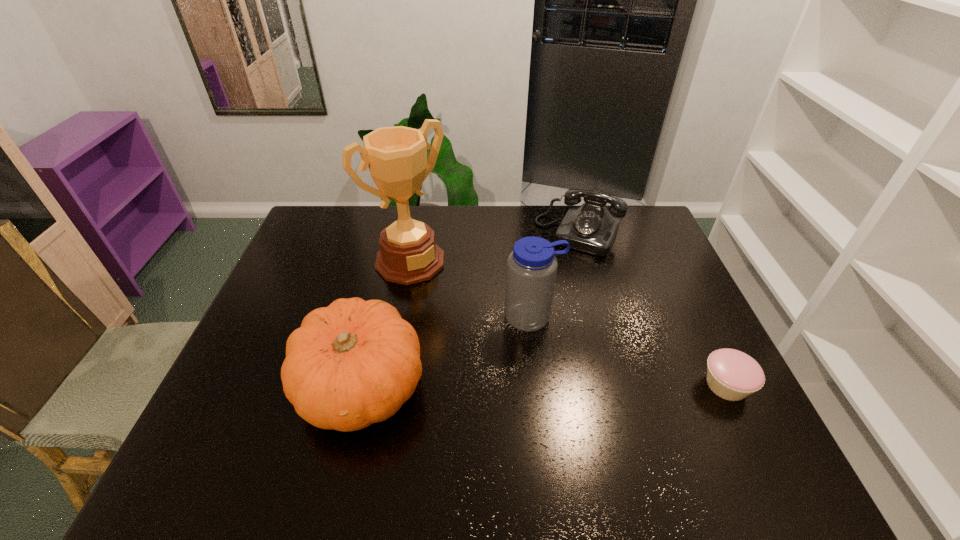
I want to click on free space at the near left corner of the desktop, so click(x=221, y=399).

At what (x,y) coordinates should I click in order to perform the action: click on free point at the far right corner. Please return your answer as a coordinate pair (x, y). The width and height of the screenshot is (960, 540). Looking at the image, I should click on (x=626, y=219).

I want to click on blank region between the third shortest object and the second shortest object, so click(470, 310).

Find the location of a particular element. blank region between the tallest object and the cupcake is located at coordinates point(568,323).

The image size is (960, 540). What are the coordinates of `free space between the tallest object and the second tallest object` in the screenshot? It's located at (471, 289).

Find the location of a particular element. This screenshot has height=540, width=960. vacant region between the rightmost object and the third nearest object is located at coordinates (629, 351).

You are a GUI agent. You are given a task and a screenshot of the screen. Output one action in this format:
    pyautogui.click(x=<x>, y=<y>)
    Task: Click on the empty location between the telephone and the tallest object
    The width and height of the screenshot is (960, 540).
    Given the screenshot: What is the action you would take?
    pyautogui.click(x=494, y=248)

The image size is (960, 540). In order to click on vacant point located between the cupcake and the award in this screenshot , I will do `click(568, 323)`.

Find the location of a particular element. This screenshot has height=540, width=960. free space between the pumpkin and the water bottle is located at coordinates (447, 352).

Locate an element on the screen. The image size is (960, 540). free space between the pumpkin and the cupcake is located at coordinates (544, 386).